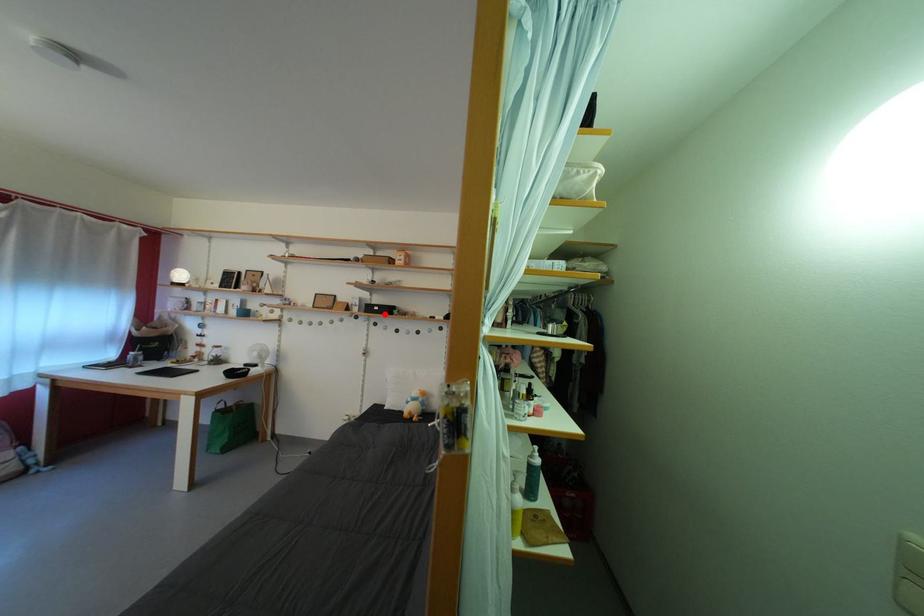
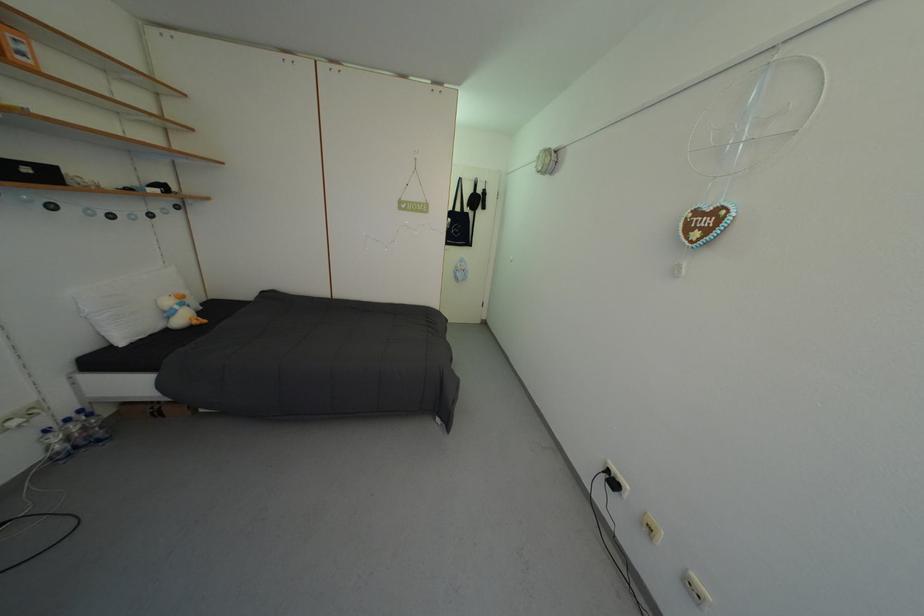
Question: I am providing you with two images of the same scene from different viewpoints. A red point is shown in image1. For the corresponding object point in image2, is it positioned nearer or farther from the camera?

Choices:
 (A) Nearer
 (B) Farther

Answer: (B)